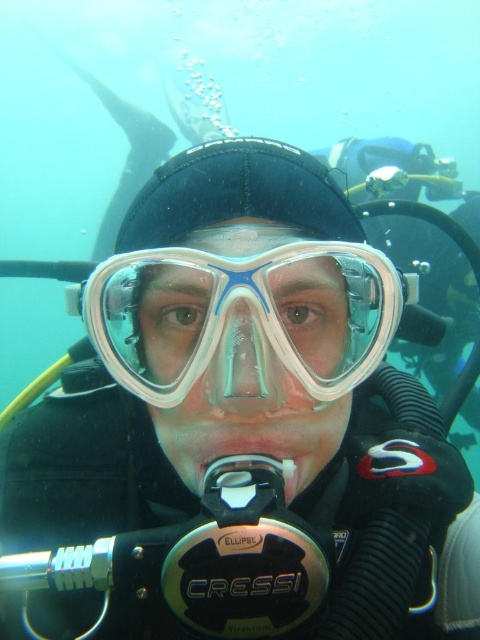
Is transparent plastic goggles at center above transparent plastic nose at center?

Yes, transparent plastic goggles at center is above transparent plastic nose at center.

Does transparent plastic goggles at center have a smaller size compared to transparent plastic nose at center?

Incorrect, transparent plastic goggles at center is not smaller in size than transparent plastic nose at center.

Does point (297, 340) come closer to viewer compared to point (228, 353)?

That is False.

At what (x,y) coordinates should I click in order to perform the action: click on transparent plastic goggles at center. Please return your answer as a coordinate pair (x, y). The image size is (480, 640). Looking at the image, I should click on (242, 321).

Is transparent plastic nose at center below white plastic mouthpiece at center?

Actually, transparent plastic nose at center is above white plastic mouthpiece at center.

Who is positioned more to the right, transparent plastic nose at center or white plastic mouthpiece at center?

Positioned to the right is white plastic mouthpiece at center.

In order to click on transparent plastic nose at center in this screenshot , I will do `click(243, 362)`.

Is transparent plastic goggles at center bigger than white plastic mouthpiece at center?

Indeed, transparent plastic goggles at center has a larger size compared to white plastic mouthpiece at center.

Is transparent plastic goggles at center to the left of white plastic mouthpiece at center from the viewer's perspective?

Indeed, transparent plastic goggles at center is positioned on the left side of white plastic mouthpiece at center.

Who is more forward, (x=297, y=250) or (x=298, y=458)?

Point (x=297, y=250) is more forward.

Locate an element on the screen. Image resolution: width=480 pixels, height=640 pixels. transparent plastic goggles at center is located at coordinates (242, 321).